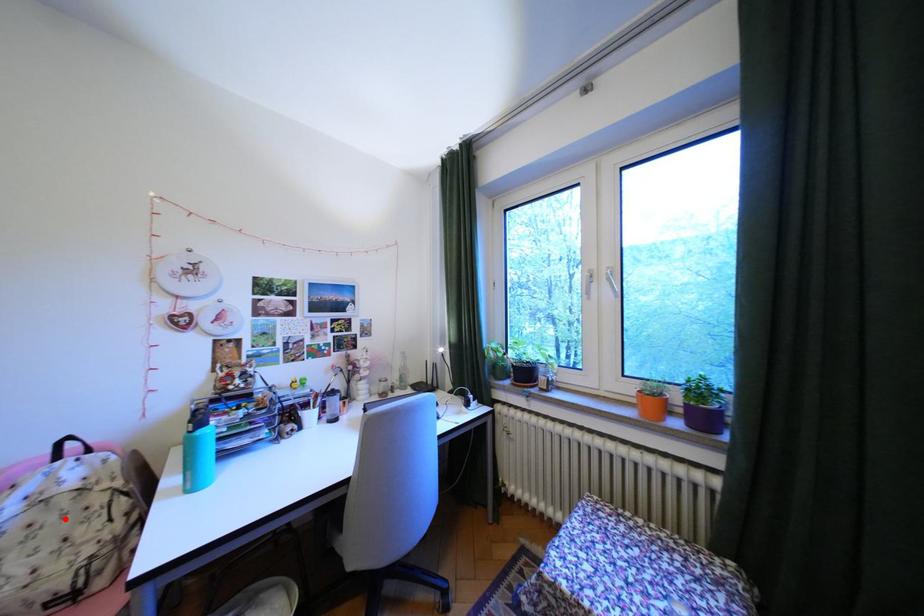
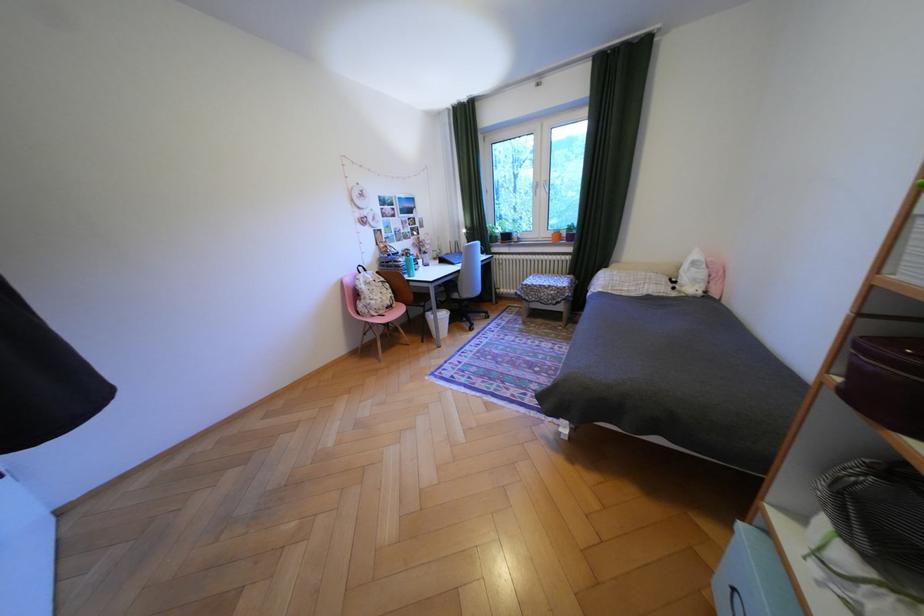
Locate, in the second image, the point that corresponds to the highlighted location in the first image.

(386, 288)